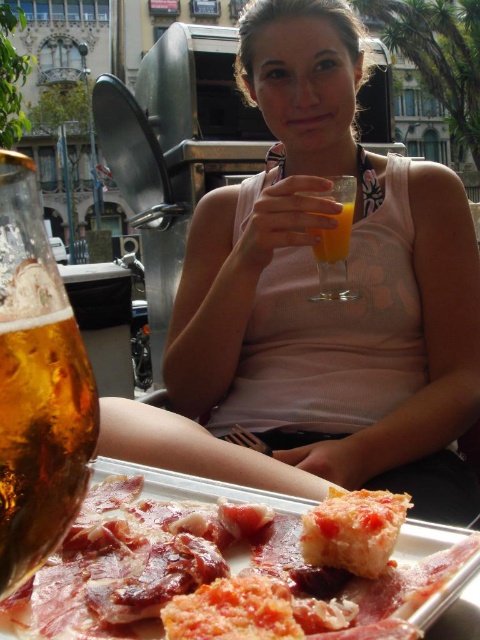
Does pink fabric dress at center have a greater width compared to golden crispy bread at lower center?

Yes, pink fabric dress at center is wider than golden crispy bread at lower center.

Can you confirm if pink fabric dress at center is positioned to the left of golden crispy bread at lower center?

Indeed, pink fabric dress at center is positioned on the left side of golden crispy bread at lower center.

The image size is (480, 640). What do you see at coordinates (331, 300) in the screenshot?
I see `pink fabric dress at center` at bounding box center [331, 300].

Where is `pink fabric dress at center`? The width and height of the screenshot is (480, 640). pink fabric dress at center is located at coordinates (331, 300).

Who is positioned more to the right, pink fabric dress at center or sliced cured meat at lower left?

sliced cured meat at lower left

Who is more forward, (409, 333) or (124, 577)?

Point (124, 577) is in front.

Locate an element on the screen. pink fabric dress at center is located at coordinates (331, 300).

I want to click on pink fabric dress at center, so (331, 300).

Which is more to the right, pink fabric dress at center or translucent amber liquid at lower left?

Positioned to the right is translucent amber liquid at lower left.

Can you confirm if pink fabric dress at center is positioned above translucent amber liquid at lower left?

Yes, pink fabric dress at center is above translucent amber liquid at lower left.

Is point (237, 420) positioned before point (86, 476)?

No, it is behind (86, 476).

Identify the location of pink fabric dress at center. (331, 300).